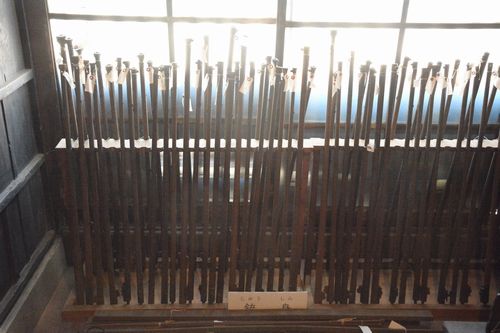
Locate an element on the screen. The image size is (500, 333). baseboard is located at coordinates (47, 289).